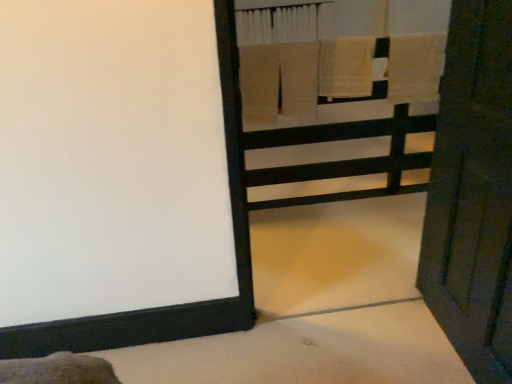
What is the approximate width of wooden bunk bed at upper right?

The width of wooden bunk bed at upper right is 5.58 inches.

Describe the element at coordinates (337, 87) in the screenshot. I see `wooden bunk bed at upper right` at that location.

The height and width of the screenshot is (384, 512). I want to click on beige cotton towel at upper right, the 2th bath towel positioned from the left, so click(415, 67).

Locate an element on the screen. The width and height of the screenshot is (512, 384). wooden bunk bed at upper right is located at coordinates (337, 87).

Is beige cotton towel at upper right, the 2th bath towel positioned from the left, aimed at wooden bunk bed at upper right?

No, beige cotton towel at upper right, the 2th bath towel positioned from the left, is not aimed at wooden bunk bed at upper right.

Find the location of `bunk bed lying in front of the beige cotton towel at upper right, the 2th bath towel positioned from the left`. bunk bed lying in front of the beige cotton towel at upper right, the 2th bath towel positioned from the left is located at coordinates (337, 87).

Considering the positions of points (411, 59) and (324, 19), is point (411, 59) closer to camera compared to point (324, 19)?

Yes, it is in front of point (324, 19).

Which is more to the right, wooden bunk bed at upper right or beige cotton towel at upper right, the 2th bath towel positioned from the left?

Positioned to the right is beige cotton towel at upper right, the 2th bath towel positioned from the left.

From the picture: Is wooden bunk bed at upper right turned away from beige cotton towel at upper right, the 1th bath towel in the right-to-left sequence?

That's not correct — wooden bunk bed at upper right is not looking away from beige cotton towel at upper right, the 1th bath towel in the right-to-left sequence.

Which is behind, point (394, 176) or point (406, 39)?

Positioned behind is point (394, 176).

Based on the photo, what's the angular difference between wooden bunk bed at upper right and beige cotton towel at upper right, the 2th bath towel positioned from the left,'s facing directions?

The facing directions of wooden bunk bed at upper right and beige cotton towel at upper right, the 2th bath towel positioned from the left, are 1.25 degrees apart.

Measure the distance from wooden bunk bed at upper right to beige cotton towel at upper center, which ranks as the first bath towel in left-to-right order.

They are 10.96 inches apart.

Is wooden bunk bed at upper right bigger than beige cotton towel at upper center, which ranks as the first bath towel in left-to-right order?

Correct, wooden bunk bed at upper right is larger in size than beige cotton towel at upper center, which ranks as the first bath towel in left-to-right order.

Considering the relative positions of wooden bunk bed at upper right and beige cotton towel at upper center, which is the second bath towel in right-to-left order, in the image provided, is wooden bunk bed at upper right to the left or to the right of beige cotton towel at upper center, which is the second bath towel in right-to-left order,?

Based on their positions, wooden bunk bed at upper right is located to the left of beige cotton towel at upper center, which is the second bath towel in right-to-left order.

In the image, there is a beige cotton towel at upper center, which is the second bath towel in right-to-left order. Find the location of `bunk bed below it (from the image's perspective)`. bunk bed below it (from the image's perspective) is located at coordinates (337, 87).

Which is nearer, (354, 86) or (481, 46)?

Point (354, 86) is positioned farther from the camera compared to point (481, 46).

Is beige cotton towel at upper center, which ranks as the first bath towel in left-to-right order, outside of wooden door at right?

Indeed, beige cotton towel at upper center, which ranks as the first bath towel in left-to-right order, is completely outside wooden door at right.

Based on the photo, which is in front, beige cotton towel at upper center, which ranks as the first bath towel in left-to-right order, or wooden door at right?

wooden door at right is more forward.

Measure the distance between wooden door at right and beige cotton towel at upper right, the 2th bath towel positioned from the left.

1.18 meters.

From the image's perspective, would you say wooden door at right is shown under beige cotton towel at upper right, the 1th bath towel in the right-to-left sequence?

Yes, from the image's perspective, wooden door at right is below beige cotton towel at upper right, the 1th bath towel in the right-to-left sequence.

Is wooden door at right oriented away from beige cotton towel at upper right, the 1th bath towel in the right-to-left sequence?

No, beige cotton towel at upper right, the 1th bath towel in the right-to-left sequence, is not at the back of wooden door at right.

Consider the image. Is beige cotton towel at upper right, the 2th bath towel positioned from the left, situated inside beige cotton towel at upper center, which ranks as the first bath towel in left-to-right order, or outside?

beige cotton towel at upper right, the 2th bath towel positioned from the left, lies outside beige cotton towel at upper center, which ranks as the first bath towel in left-to-right order.

Considering the points (434, 53) and (356, 86), which point is behind, point (434, 53) or point (356, 86)?

Point (356, 86)

Is beige cotton towel at upper right, the 2th bath towel positioned from the left, bigger than beige cotton towel at upper center, which ranks as the first bath towel in left-to-right order?

No, beige cotton towel at upper right, the 2th bath towel positioned from the left, is not bigger than beige cotton towel at upper center, which ranks as the first bath towel in left-to-right order.

Which object is wider, beige cotton towel at upper right, the 1th bath towel in the right-to-left sequence, or beige cotton towel at upper center, which ranks as the first bath towel in left-to-right order?

beige cotton towel at upper center, which ranks as the first bath towel in left-to-right order, is wider.

Can you confirm if beige cotton towel at upper center, which ranks as the first bath towel in left-to-right order, is shorter than beige cotton towel at upper right, the 1th bath towel in the right-to-left sequence?

Incorrect, the height of beige cotton towel at upper center, which ranks as the first bath towel in left-to-right order, does not fall short of that of beige cotton towel at upper right, the 1th bath towel in the right-to-left sequence.

Is beige cotton towel at upper center, which ranks as the first bath towel in left-to-right order, looking in the opposite direction of beige cotton towel at upper right, the 2th bath towel positioned from the left?

No.

Is beige cotton towel at upper center, which is the second bath towel in right-to-left order, spatially inside beige cotton towel at upper right, the 1th bath towel in the right-to-left sequence, or outside of it?

beige cotton towel at upper center, which is the second bath towel in right-to-left order, is spatially situated outside beige cotton towel at upper right, the 1th bath towel in the right-to-left sequence.

In terms of width, does beige cotton towel at upper center, which is the second bath towel in right-to-left order, look wider or thinner when compared to beige cotton towel at upper right, the 2th bath towel positioned from the left?

Clearly, beige cotton towel at upper center, which is the second bath towel in right-to-left order, has more width compared to beige cotton towel at upper right, the 2th bath towel positioned from the left.

From the image's perspective, which bath towel is the 2nd one above the wooden bunk bed at upper right? Please provide its 2D coordinates.

[(415, 67)]

What are the coordinates of `bunk bed in front of the beige cotton towel at upper right, the 2th bath towel positioned from the left` in the screenshot? It's located at (337, 87).

Looking at the image, which one is located further to wooden door at right, wooden bunk bed at upper right or beige cotton towel at upper center, which ranks as the first bath towel in left-to-right order?

wooden bunk bed at upper right lies further to wooden door at right than the other object.

Which object lies nearer to the anchor point beige cotton towel at upper center, which ranks as the first bath towel in left-to-right order, beige cotton towel at upper right, the 2th bath towel positioned from the left, or wooden bunk bed at upper right?

The object closer to beige cotton towel at upper center, which ranks as the first bath towel in left-to-right order, is beige cotton towel at upper right, the 2th bath towel positioned from the left.

Looking at the image, which one is located further to beige cotton towel at upper right, the 2th bath towel positioned from the left, wooden bunk bed at upper right or wooden door at right?

wooden door at right is positioned further to the anchor beige cotton towel at upper right, the 2th bath towel positioned from the left.

Looking at the image, which one is located further to beige cotton towel at upper right, the 1th bath towel in the right-to-left sequence, beige cotton towel at upper center, which is the second bath towel in right-to-left order, or wooden door at right?

wooden door at right.

When comparing their distances from beige cotton towel at upper center, which ranks as the first bath towel in left-to-right order, does wooden door at right or wooden bunk bed at upper right seem closer?

wooden bunk bed at upper right is closer to beige cotton towel at upper center, which ranks as the first bath towel in left-to-right order.

Consider the image. When comparing their distances from wooden bunk bed at upper right, does beige cotton towel at upper center, which ranks as the first bath towel in left-to-right order, or beige cotton towel at upper right, the 2th bath towel positioned from the left, seem further?

beige cotton towel at upper right, the 2th bath towel positioned from the left, is positioned further to the anchor wooden bunk bed at upper right.

Based on their spatial positions, is beige cotton towel at upper right, the 2th bath towel positioned from the left, or wooden door at right closer to beige cotton towel at upper center, which ranks as the first bath towel in left-to-right order?

Among the two, beige cotton towel at upper right, the 2th bath towel positioned from the left, is located nearer to beige cotton towel at upper center, which ranks as the first bath towel in left-to-right order.

Estimate the real-world distances between objects in this image. Which object is further from beige cotton towel at upper center, which ranks as the first bath towel in left-to-right order, wooden bunk bed at upper right or beige cotton towel at upper right, the 1th bath towel in the right-to-left sequence?

The object further to beige cotton towel at upper center, which ranks as the first bath towel in left-to-right order, is wooden bunk bed at upper right.

Locate an element on the screen. The height and width of the screenshot is (384, 512). bath towel between wooden door at right and beige cotton towel at upper right, the 2th bath towel positioned from the left, from front to back is located at coordinates (345, 67).

The height and width of the screenshot is (384, 512). What are the coordinates of `bunk bed between wooden door at right and beige cotton towel at upper center, which is the second bath towel in right-to-left order, from front to back` in the screenshot? It's located at (337, 87).

Where is `bath towel between wooden bunk bed at upper right and beige cotton towel at upper right, the 1th bath towel in the right-to-left sequence, from front to back`? bath towel between wooden bunk bed at upper right and beige cotton towel at upper right, the 1th bath towel in the right-to-left sequence, from front to back is located at coordinates (345, 67).

In order to click on bunk bed between wooden door at right and beige cotton towel at upper right, the 2th bath towel positioned from the left, along the z-axis in this screenshot , I will do pos(337,87).